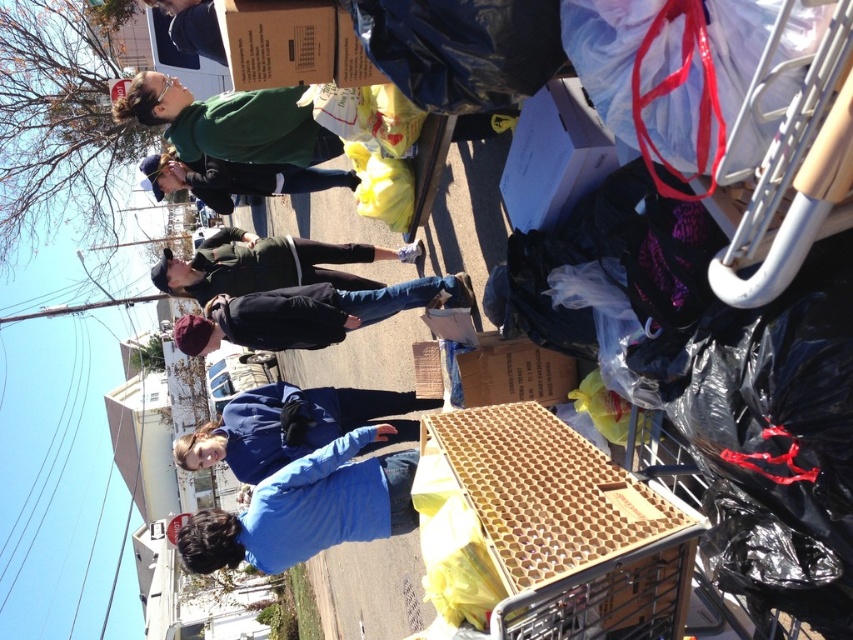
You are organizing a community cleanup and need to place the wooden crate at center and the matte black jacket at upper center into a storage room. The storage room has a narrow doorway that only allows items to pass through if they are to the left of the doorway. Based on their positions in the image, which item would you move first to ensure it can fit through the doorway?

The matte black jacket at upper center should be moved first because it is positioned to the left of the wooden crate at center, making it easier to pass through the narrow doorway that only allows items to the left.

You are a delivery person who needs to place a package on the highest point available in the scene. Which object should you choose between the blue fleece jacket at center and the brown cardboard box at center?

The brown cardboard box at center is higher than the blue fleece jacket at center, so you should place the package on the brown cardboard box at center.